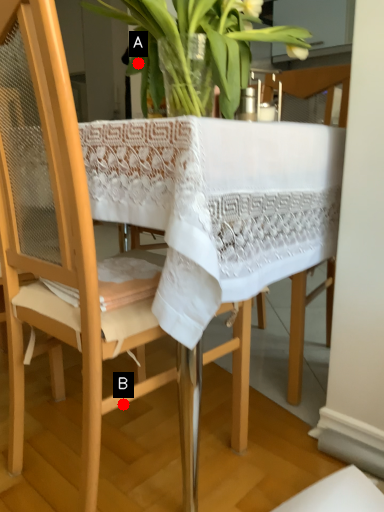
Question: Two points are circled on the image, labeled by A and B beside each circle. Which point appears farthest from the camera in this image?

Choices:
 (A) A is further
 (B) B is further

Answer: (B)